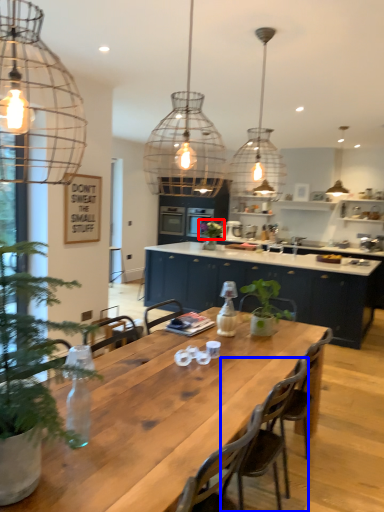
Question: Among these objects, which one is farthest to the camera, plant (highlighted by a red box) or chair (highlighted by a blue box)?

Choices:
 (A) plant
 (B) chair

Answer: (A)